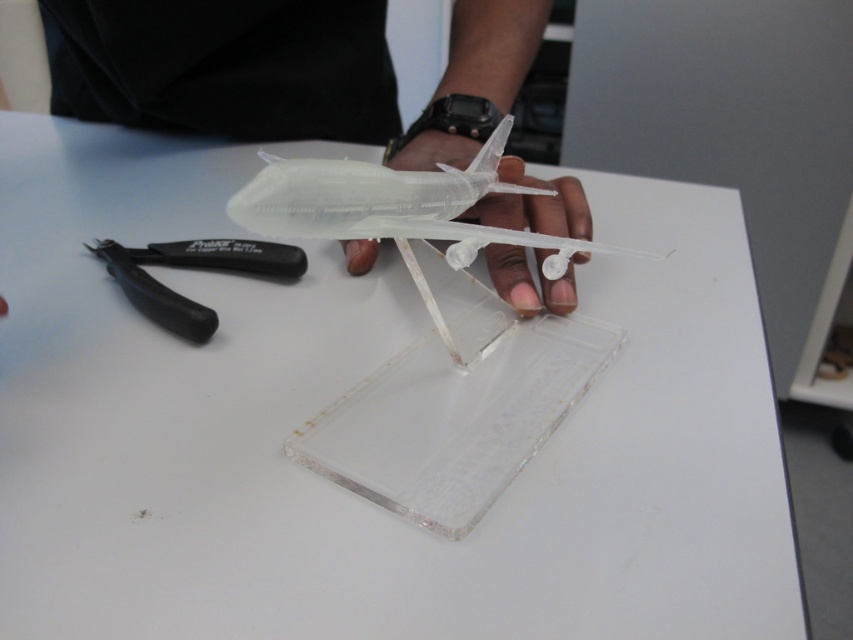
What object is located at the coordinates point [225,67] in the image?

The transparent plastic airplane at center is located at point [225,67].

From the picture: You are a student who needs to place the transparent plastic airplane at center and the black plastic pliers at left into a box. The box has a divider that separates items on the left and right. Based on their positions in the image, which side of the box should you place each object?

Since the transparent plastic airplane at center is to the right of the black plastic pliers at left in the image, you should place the black plastic pliers at left on the left side of the box and the transparent plastic airplane at center on the right side of the box to maintain their relative positions.